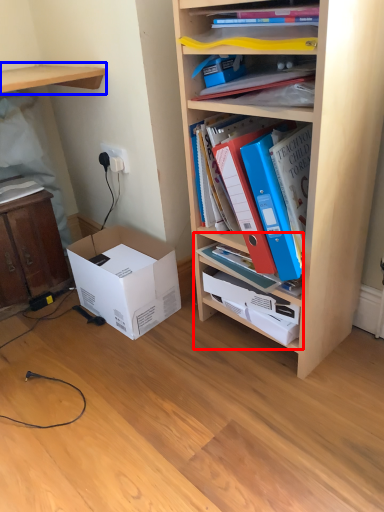
Question: Which point is closer to the camera, cabinet (highlighted by a red box) or shelf (highlighted by a blue box)?

Choices:
 (A) cabinet
 (B) shelf

Answer: (A)